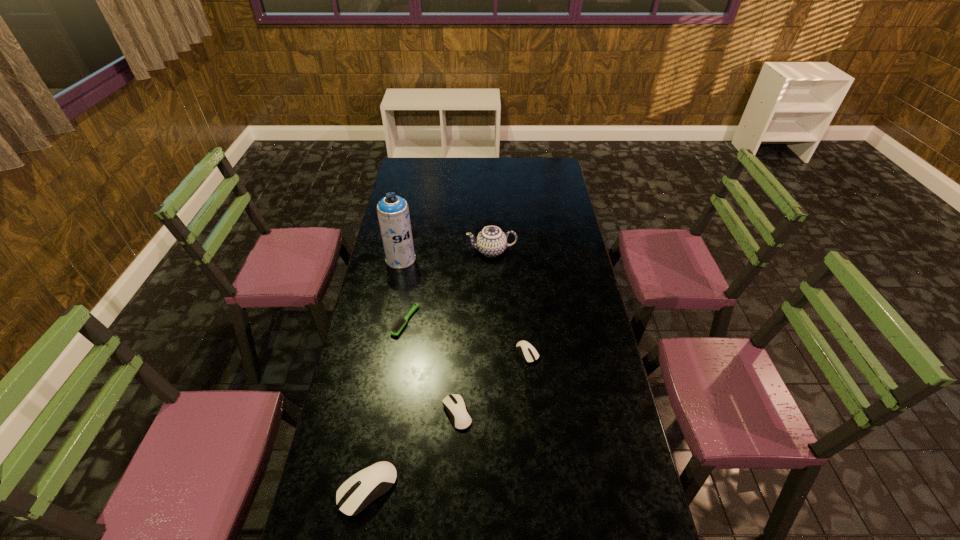
Find the location of a particular element. The image size is (960, 540). hairbrush located in the left edge section of the desktop is located at coordinates (400, 324).

Locate an element on the screen. This screenshot has height=540, width=960. object at the near left corner is located at coordinates (375, 480).

I want to click on blank space at the far edge, so click(508, 170).

Identify the location of vacant space at the near edge. (422, 511).

Locate an element on the screen. The height and width of the screenshot is (540, 960). vacant space at the left edge of the desktop is located at coordinates (352, 367).

Locate an element on the screen. free space at the right edge is located at coordinates (536, 188).

Image resolution: width=960 pixels, height=540 pixels. Find the location of `vacant area at the far left corner`. vacant area at the far left corner is located at coordinates (406, 164).

You are a GUI agent. You are given a task and a screenshot of the screen. Output one action in this format:
    pyautogui.click(x=<x>, y=<y>)
    Task: Click on the vacant area at the far right corner
    
    Given the screenshot: What is the action you would take?
    pyautogui.click(x=536, y=176)

In order to click on free space between the second tallest object and the second nearest object in this screenshot , I will do `click(474, 332)`.

Find the location of a particular element. The width and height of the screenshot is (960, 540). free spot between the rightmost mouse and the nearest mouse is located at coordinates coord(447,421).